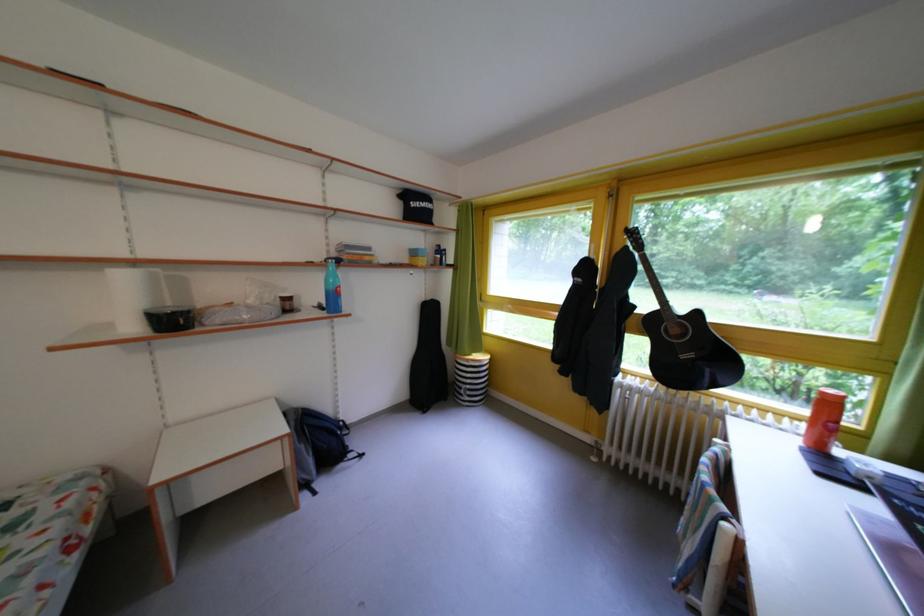
Find where to lift the black guitar case. Please return your answer as a coordinate pair (x, y).

(428, 360)